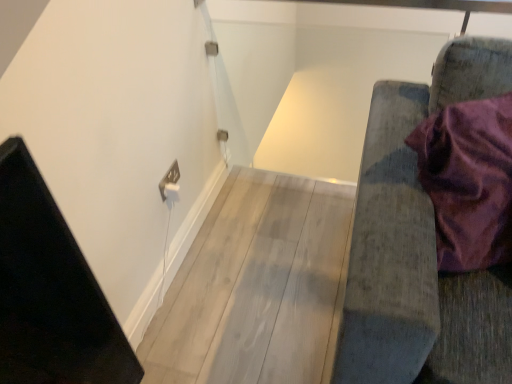
Question: Does velvet purple cushion at right lie behind white plastic electric outlet at upper left?

Choices:
 (A) yes
 (B) no

Answer: (B)

Question: From the image's perspective, would you say velvet purple cushion at right is shown under white plastic electric outlet at upper left?

Choices:
 (A) yes
 (B) no

Answer: (A)

Question: Is velvet purple cushion at right located outside white plastic electric outlet at upper left?

Choices:
 (A) yes
 (B) no

Answer: (A)

Question: Does velvet purple cushion at right lie in front of white plastic electric outlet at upper left?

Choices:
 (A) no
 (B) yes

Answer: (B)

Question: Is velvet purple cushion at right positioned with its back to white plastic electric outlet at upper left?

Choices:
 (A) yes
 (B) no

Answer: (B)

Question: Can you confirm if velvet purple cushion at right is positioned to the right of white plastic electric outlet at upper left?

Choices:
 (A) no
 (B) yes

Answer: (B)

Question: Can you confirm if white plastic electric outlet at upper left is smaller than velvet purple cushion at right?

Choices:
 (A) no
 (B) yes

Answer: (B)

Question: Is white plastic electric outlet at upper left aimed at velvet purple cushion at right?

Choices:
 (A) yes
 (B) no

Answer: (A)

Question: Is white plastic electric outlet at upper left bigger than velvet purple cushion at right?

Choices:
 (A) yes
 (B) no

Answer: (B)

Question: From the image's perspective, is white plastic electric outlet at upper left beneath velvet purple cushion at right?

Choices:
 (A) no
 (B) yes

Answer: (A)

Question: Does white plastic electric outlet at upper left have a lesser width compared to velvet purple cushion at right?

Choices:
 (A) yes
 (B) no

Answer: (A)

Question: Is white plastic electric outlet at upper left not inside velvet purple cushion at right?

Choices:
 (A) yes
 (B) no

Answer: (A)

Question: Would you say white plastic electric outlet at upper left is to the left or to the right of velvet purple cushion at right in the picture?

Choices:
 (A) left
 (B) right

Answer: (A)